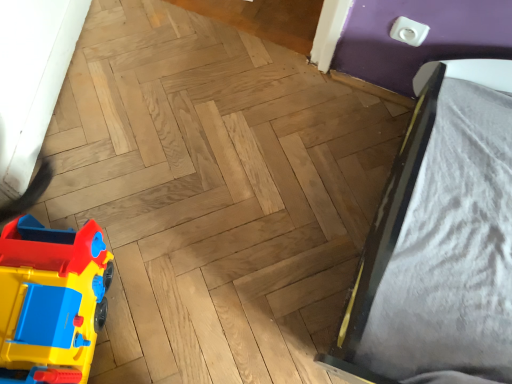
At what (x,y) coordinates should I click in order to perform the action: click on free space above matte plastic toy car at lower left (from a real-world perspective). Please return your answer as a coordinate pair (x, y). Looking at the image, I should click on [x=32, y=289].